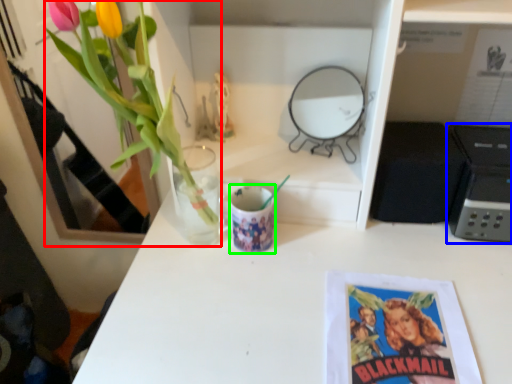
Question: Considering the real-world distances, which object is farthest from floral arrangement (highlighted by a red box)? appliance (highlighted by a blue box) or mug (highlighted by a green box)?

Choices:
 (A) appliance
 (B) mug

Answer: (A)